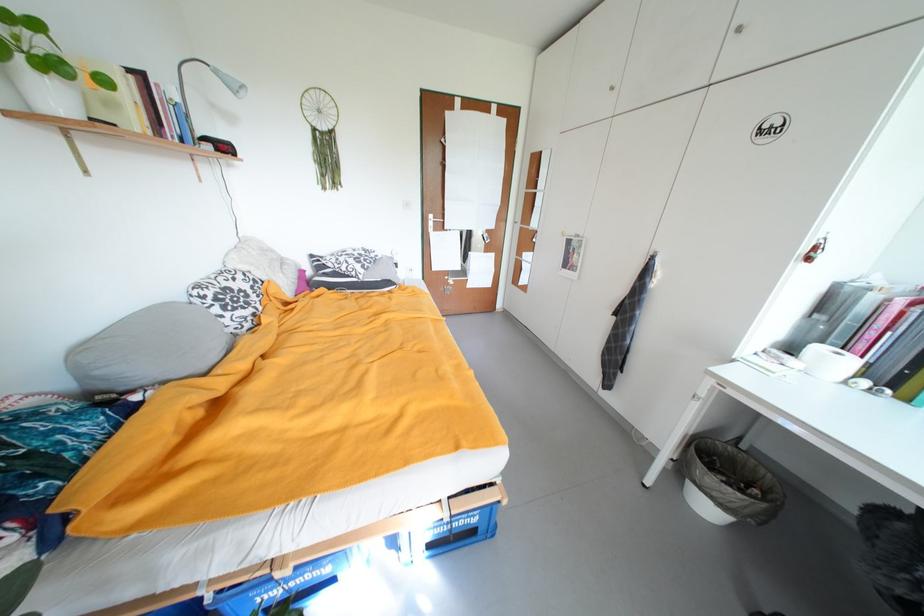
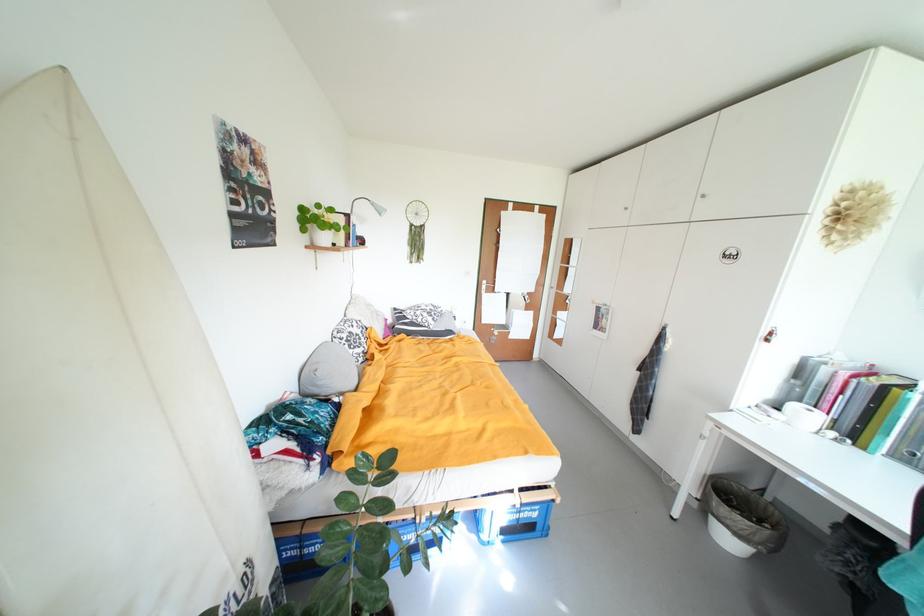
The images are taken continuously from a first-person perspective. In which direction are you moving?

The cameraman walked toward left, backward.